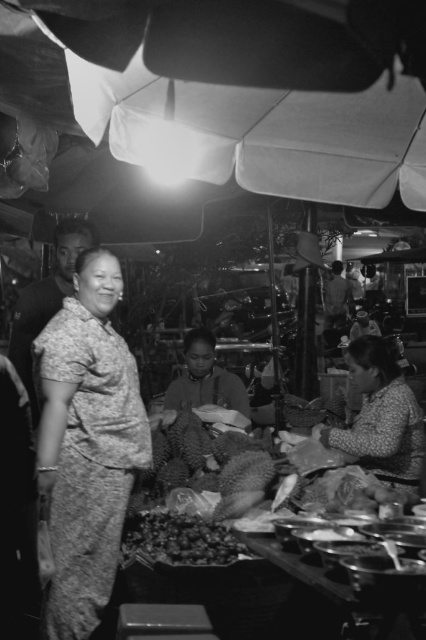
Does point (58, 609) lie in front of point (354, 451)?

Yes, point (58, 609) is closer to viewer.

Identify the location of dotted fabric dress at left. The image size is (426, 640). (86, 444).